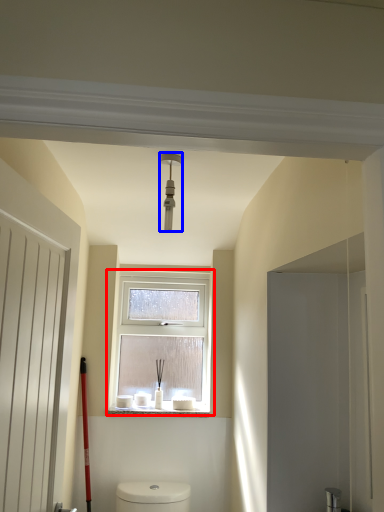
Question: Which point is further to the camera, window (highlighted by a red box) or light fixture (highlighted by a blue box)?

Choices:
 (A) window
 (B) light fixture

Answer: (A)